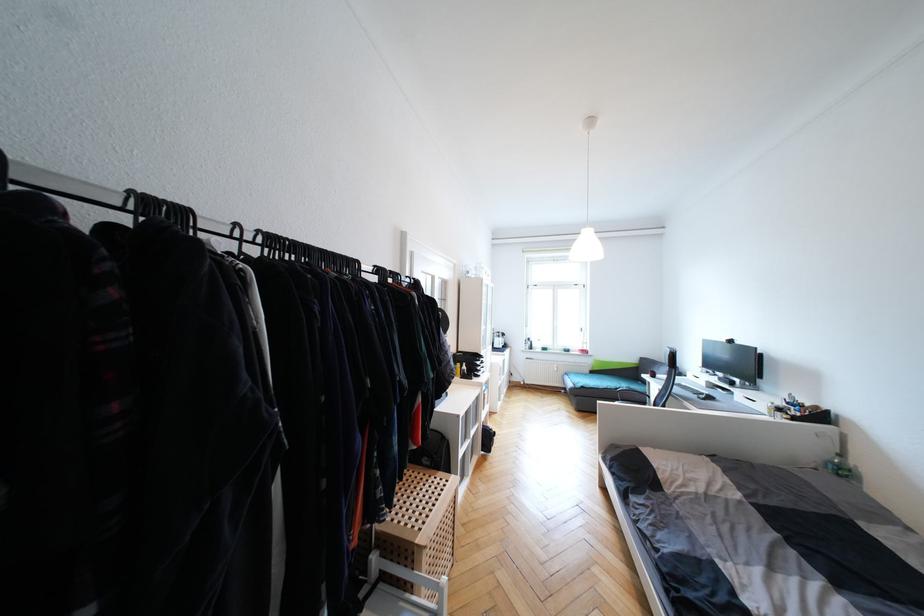
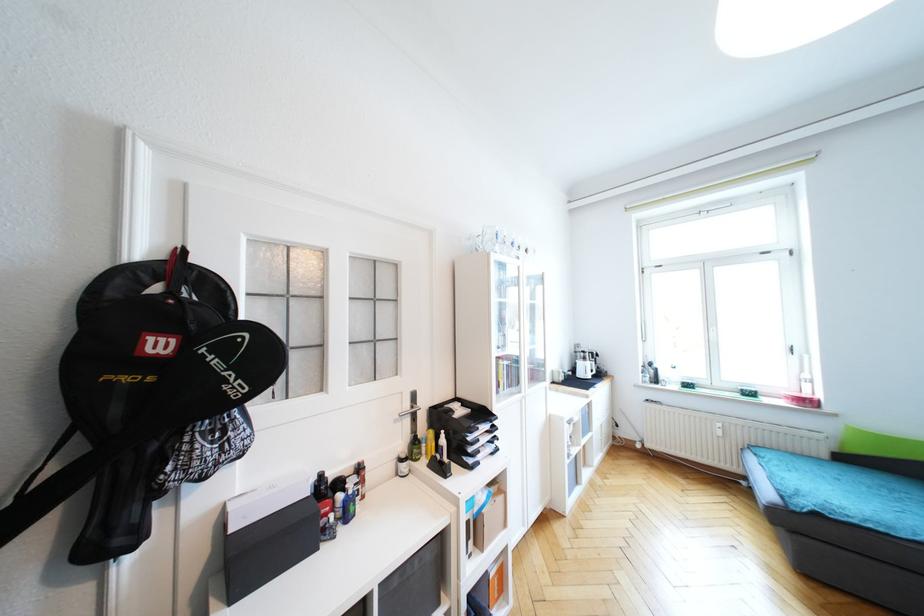
The images are taken continuously from a first-person perspective. In which direction are you moving?

The cameraman walked toward right, forward.